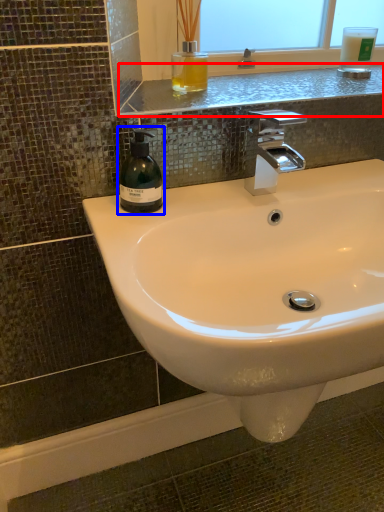
Question: Which object is closer to the camera taking this photo, window sill (highlighted by a red box) or soap dispenser (highlighted by a blue box)?

Choices:
 (A) window sill
 (B) soap dispenser

Answer: (B)